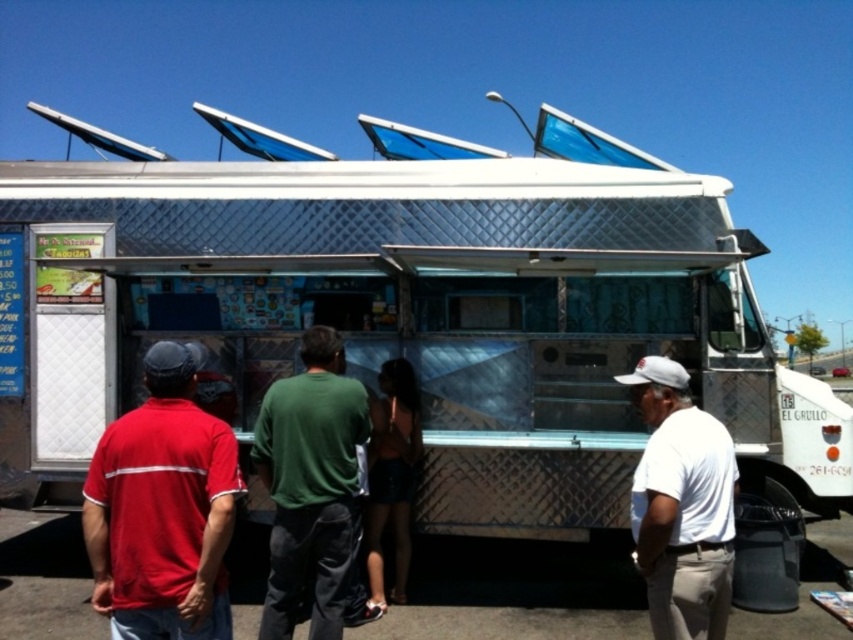
You are standing in front of the food truck and want to reach both the point at coordinates point (108, 477) and point (300, 481). Which point should you reach first to touch them in order from closest to farthest?

You should reach the point (108, 477) first because it is closer to you than the point (300, 481).

You are a photographer trying to capture the scene of the food truck. You need to ensure that both the matte red shirt at left and the white matte shirt at right are visible in your photo. Based on their sizes, which customer should you focus on to ensure they are fully in frame first?

The matte red shirt at left is wider than the white matte shirt at right, so you should focus on the matte red shirt at left first to ensure it is fully in frame before adjusting for the white matte shirt at right.